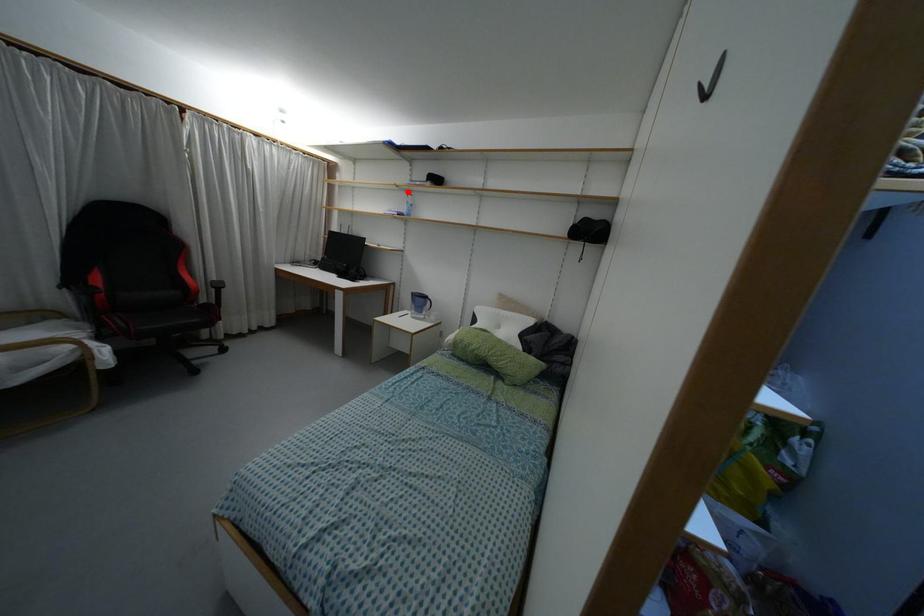
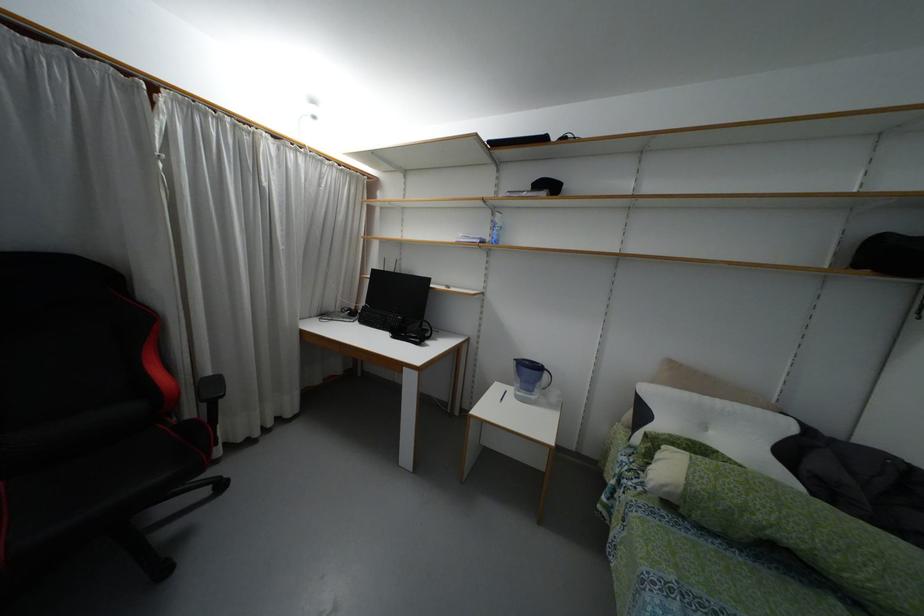
In the second image, find the point that corresponds to the highlighted location in the first image.

(493, 209)